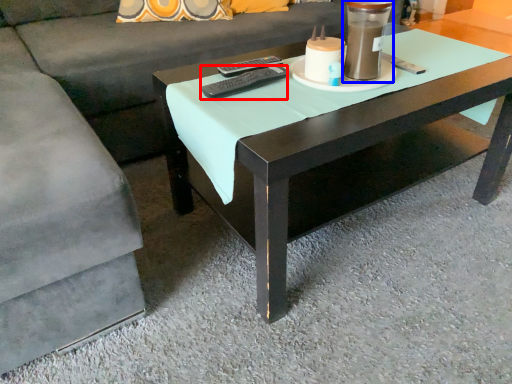
Question: Among these objects, which one is nearest to the camera, remote (highlighted by a red box) or candle holder (highlighted by a blue box)?

Choices:
 (A) remote
 (B) candle holder

Answer: (B)